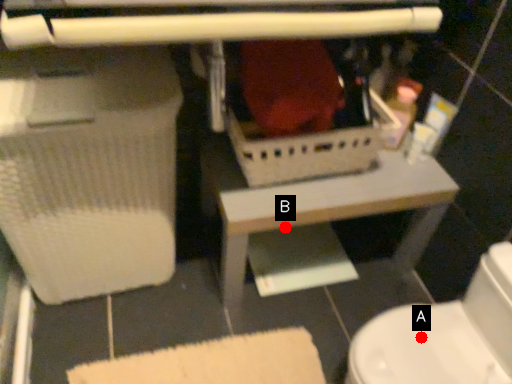
Question: Two points are circled on the image, labeled by A and B beside each circle. Among these points, which one is nearest to the camera?

Choices:
 (A) A is closer
 (B) B is closer

Answer: (A)